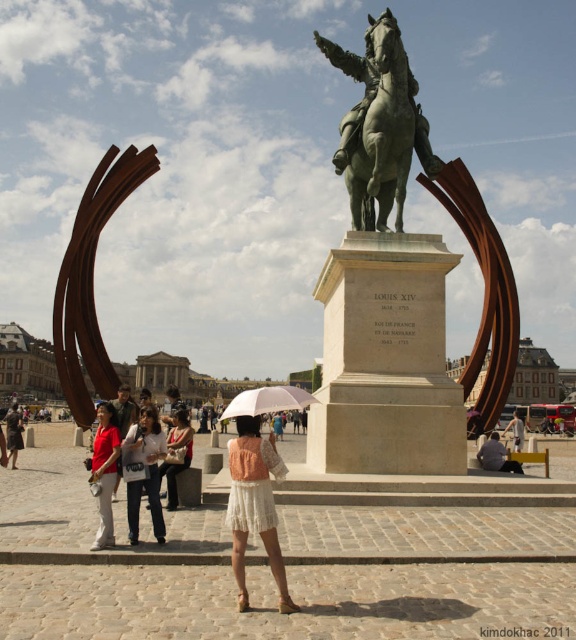
This screenshot has height=640, width=576. What do you see at coordinates (144, 472) in the screenshot?
I see `white cotton shirt at center` at bounding box center [144, 472].

The image size is (576, 640). I want to click on white cotton shirt at center, so click(144, 472).

Is bronze statue of horse at center positioned in front of white lace dress at center?

No, it is behind white lace dress at center.

Is point (369, 104) closer to camera compared to point (248, 508)?

That is False.

This screenshot has height=640, width=576. In order to click on bronze statue of horse at center in this screenshot , I will do `click(382, 131)`.

Is green polished bronze statue at center bigger than white matte umbrella at center?

Incorrect, green polished bronze statue at center is not larger than white matte umbrella at center.

Does green polished bronze statue at center have a greater height compared to white matte umbrella at center?

In fact, green polished bronze statue at center may be shorter than white matte umbrella at center.

The width and height of the screenshot is (576, 640). Identify the location of green polished bronze statue at center. (403, 301).